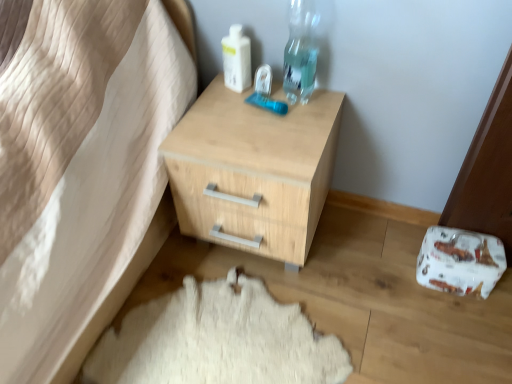
Describe the element at coordinates (300, 51) in the screenshot. I see `transparent plastic bottle at upper right` at that location.

Measure the distance between point (231, 69) and camera.

They are 1.22 meters apart.

Locate an element on the screen. The width and height of the screenshot is (512, 384). white woolen rug at lower center is located at coordinates (217, 340).

Is white plastic bottle at upper center in front of or behind transparent plastic bottle at upper right in the image?

Clearly, white plastic bottle at upper center is behind transparent plastic bottle at upper right.

Who is bigger, white plastic bottle at upper center or transparent plastic bottle at upper right?

Bigger between the two is transparent plastic bottle at upper right.

Consider the image. From a real-world perspective, who is located higher, white plastic bottle at upper center or transparent plastic bottle at upper right?

transparent plastic bottle at upper right, from a real-world perspective.

Between white plastic bottle at upper center and transparent plastic bottle at upper right, which one appears on the right side from the viewer's perspective?

From the viewer's perspective, transparent plastic bottle at upper right appears more on the right side.

Is white plastic bottle at upper center not near natural wood chest of drawers at center?

white plastic bottle at upper center is near natural wood chest of drawers at center, not far away.

At what (x,y) coordinates should I click in order to perform the action: click on chest of drawers below the white plastic bottle at upper center (from a real-world perspective). Please return your answer as a coordinate pair (x, y). Image resolution: width=512 pixels, height=384 pixels. Looking at the image, I should click on (253, 171).

From a real-world perspective, is white plastic bottle at upper center physically above natural wood chest of drawers at center?

Yes, from a real-world perspective, white plastic bottle at upper center is above natural wood chest of drawers at center.

Is white plastic bottle at upper center further to the viewer compared to natural wood chest of drawers at center?

Yes, it is.

Consider the image. Is transparent plastic bottle at upper right far from white woolen rug at lower center?

That's not correct — transparent plastic bottle at upper right is a little close to white woolen rug at lower center.

Does transparent plastic bottle at upper right have a larger size compared to white woolen rug at lower center?

Incorrect, transparent plastic bottle at upper right is not larger than white woolen rug at lower center.

From a real-world perspective, which object rests below the other?

white woolen rug at lower center, from a real-world perspective.

Measure the distance between transparent plastic bottle at upper right and white woolen rug at lower center.

28.30 inches.

Which is further, (x=281, y=171) or (x=296, y=78)?

The point (x=296, y=78) is farther from the camera.

From the image's perspective, relative to transparent plastic bottle at upper right, is natural wood chest of drawers at center above or below?

From the image's perspective, natural wood chest of drawers at center appears below transparent plastic bottle at upper right.

Is natural wood chest of drawers at center oriented towards transparent plastic bottle at upper right?

No.

Is transparent plastic bottle at upper right a part of natural wood chest of drawers at center?

No, transparent plastic bottle at upper right is located outside of natural wood chest of drawers at center.

Which is correct: white woolen rug at lower center is inside transparent plastic bottle at upper right, or outside of it?

white woolen rug at lower center cannot be found inside transparent plastic bottle at upper right.

Is white woolen rug at lower center aimed at transparent plastic bottle at upper right?

No, white woolen rug at lower center is not aimed at transparent plastic bottle at upper right.

Does white woolen rug at lower center have a lesser height compared to transparent plastic bottle at upper right?

Yes, white woolen rug at lower center is shorter than transparent plastic bottle at upper right.

Is transparent plastic bottle at upper right inside or outside of white plastic bottle at upper center?

transparent plastic bottle at upper right cannot be found inside white plastic bottle at upper center.

Is transparent plastic bottle at upper right positioned behind white plastic bottle at upper center?

No, transparent plastic bottle at upper right is closer to the viewer.

From the image's perspective, which is below, transparent plastic bottle at upper right or white plastic bottle at upper center?

white plastic bottle at upper center, from the image's perspective.

From a real-world perspective, relative to white plastic bottle at upper center, is transparent plastic bottle at upper right vertically above or below?

From a real-world perspective, transparent plastic bottle at upper right is physically above white plastic bottle at upper center.

You are a GUI agent. You are given a task and a screenshot of the screen. Output one action in this format:
    pyautogui.click(x=<x>, y=<y>)
    Task: Click on the chest of drawers located below the white plastic bottle at upper center (from the image's perspective)
    This screenshot has height=384, width=512.
    Given the screenshot: What is the action you would take?
    pyautogui.click(x=253, y=171)

Can you tell me how much natural wood chest of drawers at center and white plastic bottle at upper center differ in facing direction?

The angle between the facing direction of natural wood chest of drawers at center and the facing direction of white plastic bottle at upper center is 15.8 degrees.

Between natural wood chest of drawers at center and white plastic bottle at upper center, which one has larger width?

With larger width is natural wood chest of drawers at center.

Measure the distance between natural wood chest of drawers at center and white plastic bottle at upper center.

natural wood chest of drawers at center is 11.14 inches away from white plastic bottle at upper center.

I want to click on toiletry behind the transparent plastic bottle at upper right, so click(236, 59).

In the image, there is a white plastic bottle at upper center. What are the coordinates of `the chest of drawers below it (from a real-world perspective)` in the screenshot? It's located at pos(253,171).

From the image, which object appears to be farther from natural wood chest of drawers at center, white plastic bottle at upper center or white woolen rug at lower center?

white woolen rug at lower center is further to natural wood chest of drawers at center.

Which object lies further to the anchor point white woolen rug at lower center, transparent plastic bottle at upper right or natural wood chest of drawers at center?

transparent plastic bottle at upper right is further to white woolen rug at lower center.

Estimate the real-world distances between objects in this image. Which object is further from white woolen rug at lower center, natural wood chest of drawers at center or transparent plastic bottle at upper right?

transparent plastic bottle at upper right is positioned further to the anchor white woolen rug at lower center.

Which object lies nearer to the anchor point white woolen rug at lower center, natural wood chest of drawers at center or white plastic bottle at upper center?

natural wood chest of drawers at center.

From the image, which object appears to be nearer to white plastic bottle at upper center, natural wood chest of drawers at center or transparent plastic bottle at upper right?

transparent plastic bottle at upper right lies closer to white plastic bottle at upper center than the other object.

From the image, which object appears to be farther from white woolen rug at lower center, white plastic bottle at upper center or natural wood chest of drawers at center?

white plastic bottle at upper center is further to white woolen rug at lower center.

Which object lies nearer to the anchor point white plastic bottle at upper center, white woolen rug at lower center or transparent plastic bottle at upper right?

Among the two, transparent plastic bottle at upper right is located nearer to white plastic bottle at upper center.

Based on their spatial positions, is white plastic bottle at upper center or natural wood chest of drawers at center further from transparent plastic bottle at upper right?

The object further to transparent plastic bottle at upper right is natural wood chest of drawers at center.

Locate an element on the screen. chest of drawers between transparent plastic bottle at upper right and white woolen rug at lower center in the up-down direction is located at coordinates (253, 171).

Where is `the chest of drawers that lies between white plastic bottle at upper center and white woolen rug at lower center from top to bottom`? The height and width of the screenshot is (384, 512). the chest of drawers that lies between white plastic bottle at upper center and white woolen rug at lower center from top to bottom is located at coordinates 253,171.

Locate an element on the screen. The height and width of the screenshot is (384, 512). toiletry that lies between transparent plastic bottle at upper right and white woolen rug at lower center from top to bottom is located at coordinates (236, 59).

Where is `toiletry between transparent plastic bottle at upper right and natural wood chest of drawers at center in the up-down direction`? Image resolution: width=512 pixels, height=384 pixels. toiletry between transparent plastic bottle at upper right and natural wood chest of drawers at center in the up-down direction is located at coordinates (236, 59).